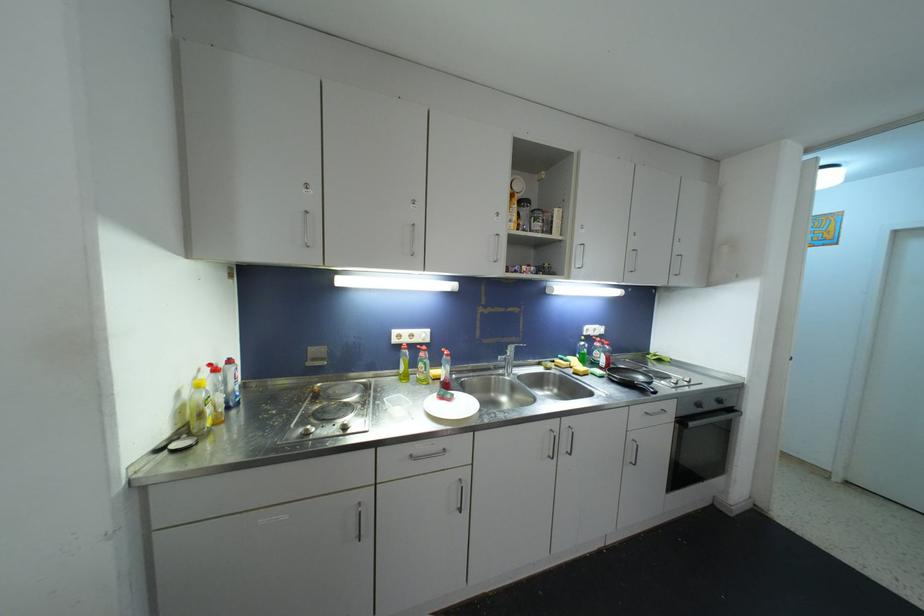
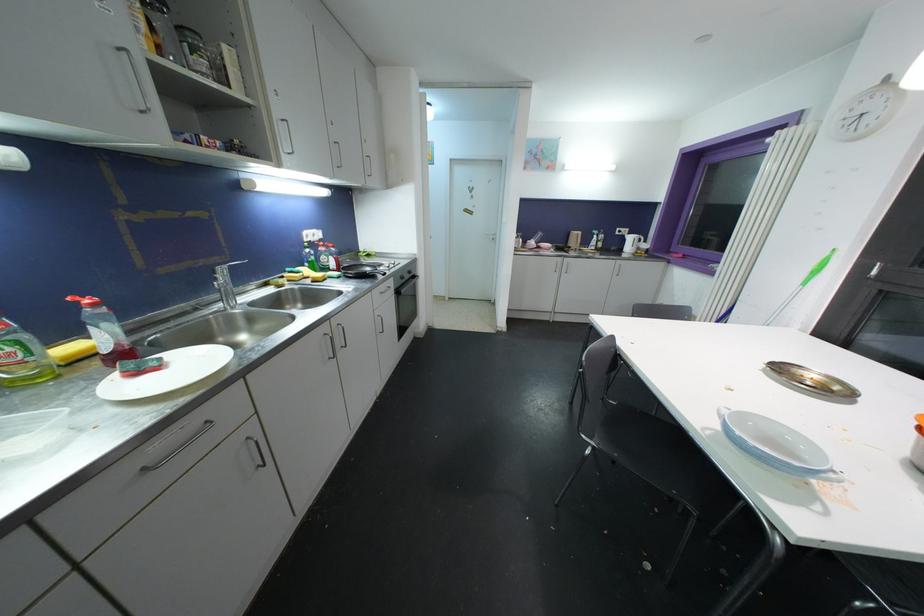
First-person continuous shooting, in which direction is the camera rotating?

The camera's rotation is toward right-down.